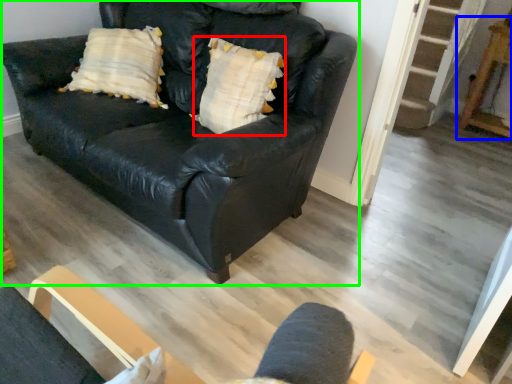
Question: Which is farther away from pillow (highlighted by a red box)? table (highlighted by a blue box) or studio couch (highlighted by a green box)?

Choices:
 (A) table
 (B) studio couch

Answer: (A)